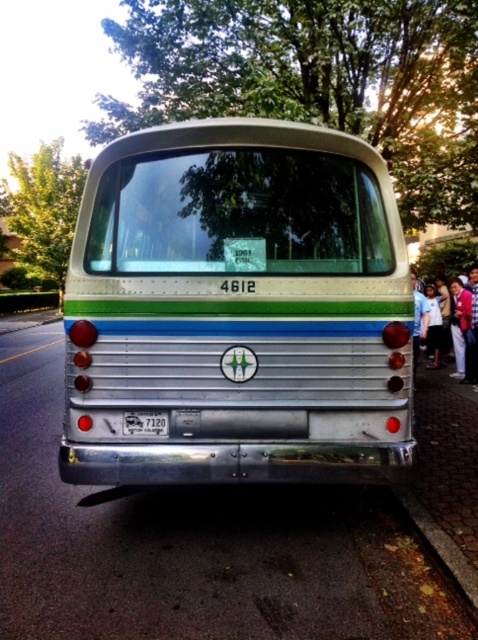
Question: Considering the real-world distances, which object is farthest from the matte pink clothing at right?

Choices:
 (A) brown textured curb at lower right
 (B) metallic silver bus at center

Answer: (B)

Question: Can you confirm if matte pink clothing at right is thinner than white plastic license plate at center?

Choices:
 (A) no
 (B) yes

Answer: (A)

Question: Can you confirm if brown textured curb at lower right is positioned to the right of matte pink clothing at right?

Choices:
 (A) yes
 (B) no

Answer: (B)

Question: Considering the real-world distances, which object is closest to the matte pink clothing at right?

Choices:
 (A) brown textured curb at lower right
 (B) white plastic license plate at center
 (C) metallic silver bus at center

Answer: (A)

Question: In this image, where is matte pink clothing at right located relative to white plastic license plate at center?

Choices:
 (A) below
 (B) above

Answer: (B)

Question: Which object appears farthest from the camera in this image?

Choices:
 (A) white plastic license plate at center
 (B) brown textured curb at lower right
 (C) matte pink clothing at right
 (D) metallic silver bus at center

Answer: (C)